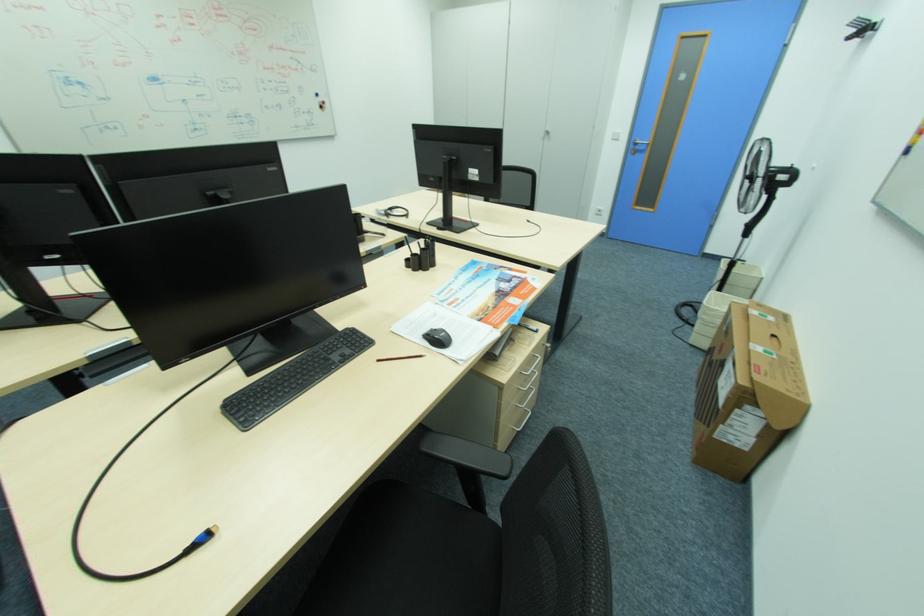
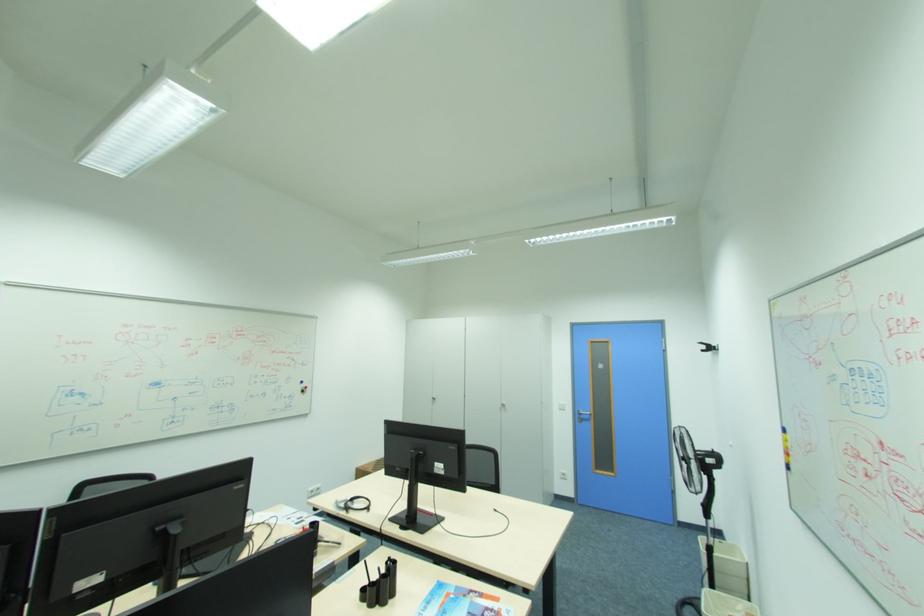
Question: How did the camera likely rotate?

Choices:
 (A) Left
 (B) Right
 (C) Up
 (D) Down

Answer: (C)